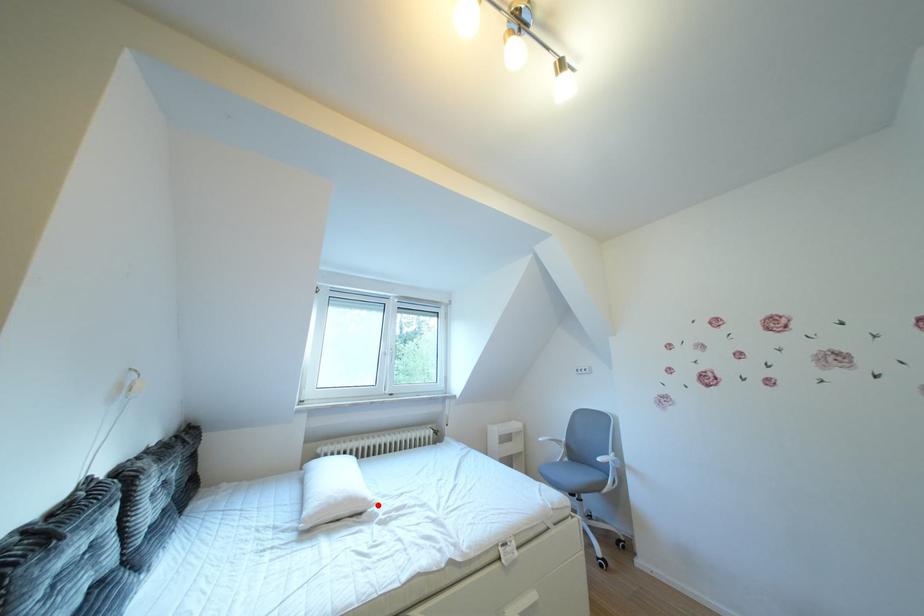
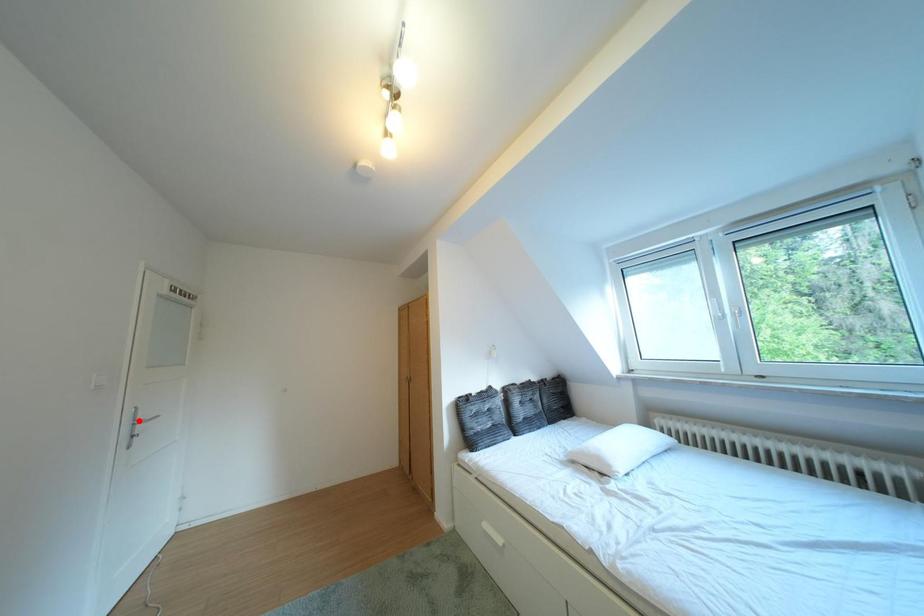
I am providing you with two images of the same scene from different viewpoints. A red point is marked on the first image and another point is marked on the second image. Are the points marked in image1 and image2 representing the same 3D position?

No